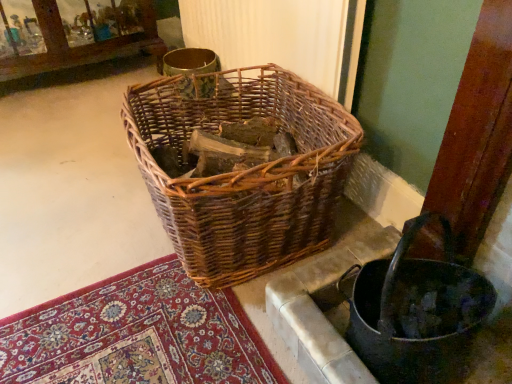
Locate an element on the screen. This screenshot has width=512, height=384. free region on the left part of woven brown basket at center is located at coordinates (80, 224).